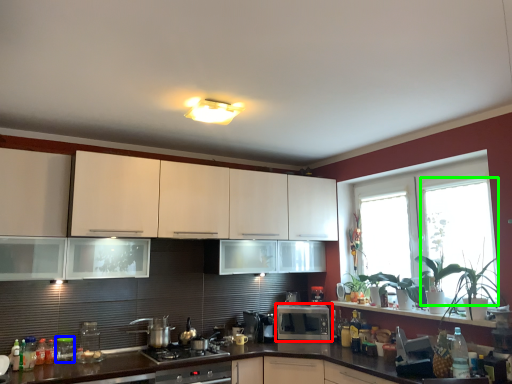
Question: Which is farther away from microwave oven (highlighted by a red box)? appliance (highlighted by a blue box) or window screen (highlighted by a green box)?

Choices:
 (A) appliance
 (B) window screen

Answer: (A)